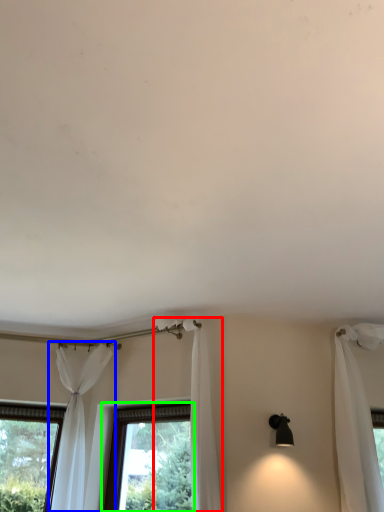
Question: Which is nearer to the curtain (highlighted by a red box)? curtain (highlighted by a blue box) or window (highlighted by a green box).

Choices:
 (A) curtain
 (B) window

Answer: (B)